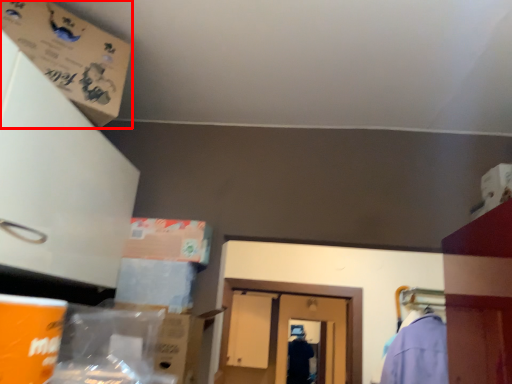
Question: Considering the relative positions of cardboard box (annotated by the red box) and cardboard box in the image provided, where is cardboard box (annotated by the red box) located with respect to the staircase?

Choices:
 (A) left
 (B) right

Answer: (A)